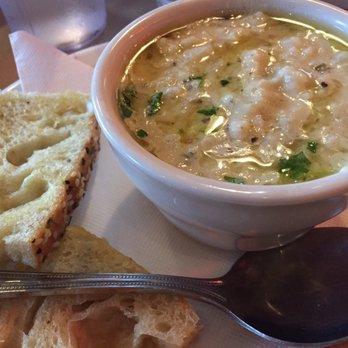
This screenshot has width=348, height=348. In order to click on spoon handle in this screenshot , I will do (x=42, y=284).